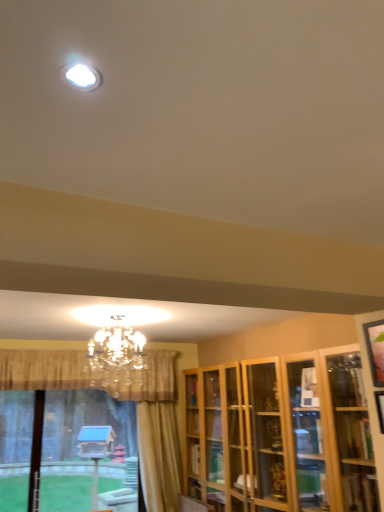
Question: Is white glossy light fixture at upper center surrounding wooden cabinet at right?

Choices:
 (A) yes
 (B) no

Answer: (B)

Question: Does white glossy light fixture at upper center have a greater height compared to wooden cabinet at right?

Choices:
 (A) yes
 (B) no

Answer: (B)

Question: Can you confirm if white glossy light fixture at upper center is shorter than wooden cabinet at right?

Choices:
 (A) no
 (B) yes

Answer: (B)

Question: Does white glossy light fixture at upper center lie behind wooden cabinet at right?

Choices:
 (A) yes
 (B) no

Answer: (B)

Question: Considering the relative positions of white glossy light fixture at upper center and wooden cabinet at right in the image provided, is white glossy light fixture at upper center to the right of wooden cabinet at right from the viewer's perspective?

Choices:
 (A) no
 (B) yes

Answer: (A)

Question: Looking at their shapes, would you say white glossy light fixture at upper center is wider or thinner than translucent glass bay window at lower left?

Choices:
 (A) wide
 (B) thin

Answer: (B)

Question: In the image, is white glossy light fixture at upper center positioned in front of or behind translucent glass bay window at lower left?

Choices:
 (A) behind
 (B) front

Answer: (B)

Question: Choose the correct answer: Is white glossy light fixture at upper center inside translucent glass bay window at lower left or outside it?

Choices:
 (A) outside
 (B) inside

Answer: (A)

Question: From the image's perspective, is white glossy light fixture at upper center located above or below translucent glass bay window at lower left?

Choices:
 (A) below
 (B) above

Answer: (B)

Question: From the image's perspective, is wooden picture frame at right, which is the first picture frame from bottom to top, located above or below white glossy light fixture at upper center?

Choices:
 (A) below
 (B) above

Answer: (A)

Question: Which is correct: wooden picture frame at right, which is the first picture frame from bottom to top, is inside white glossy light fixture at upper center, or outside of it?

Choices:
 (A) inside
 (B) outside

Answer: (B)

Question: Is wooden picture frame at right, acting as the 2th picture frame starting from the top, bigger or smaller than white glossy light fixture at upper center?

Choices:
 (A) small
 (B) big

Answer: (B)

Question: Is wooden picture frame at right, acting as the 2th picture frame starting from the top, taller or shorter than white glossy light fixture at upper center?

Choices:
 (A) short
 (B) tall

Answer: (B)

Question: Considering the positions of wooden picture frame at right, which is the first picture frame from bottom to top, and wooden picture frame at upper right, marked as the 2th picture frame in a bottom-to-top arrangement, in the image, is wooden picture frame at right, which is the first picture frame from bottom to top, taller or shorter than wooden picture frame at upper right, marked as the 2th picture frame in a bottom-to-top arrangement,?

Choices:
 (A) short
 (B) tall

Answer: (A)

Question: Relative to wooden picture frame at upper right, which is counted as the first picture frame, starting from the top, is wooden picture frame at right, acting as the 2th picture frame starting from the top, in front or behind?

Choices:
 (A) front
 (B) behind

Answer: (A)